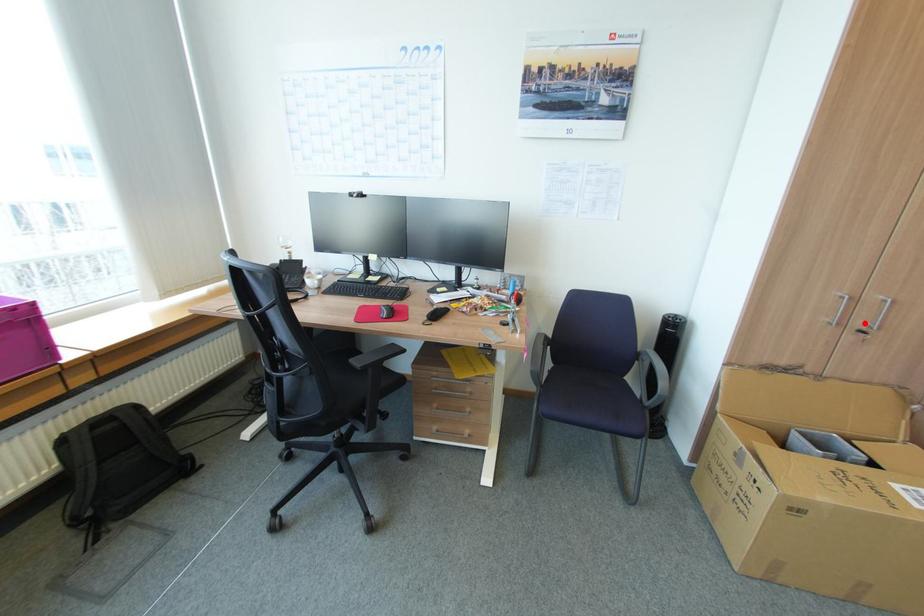
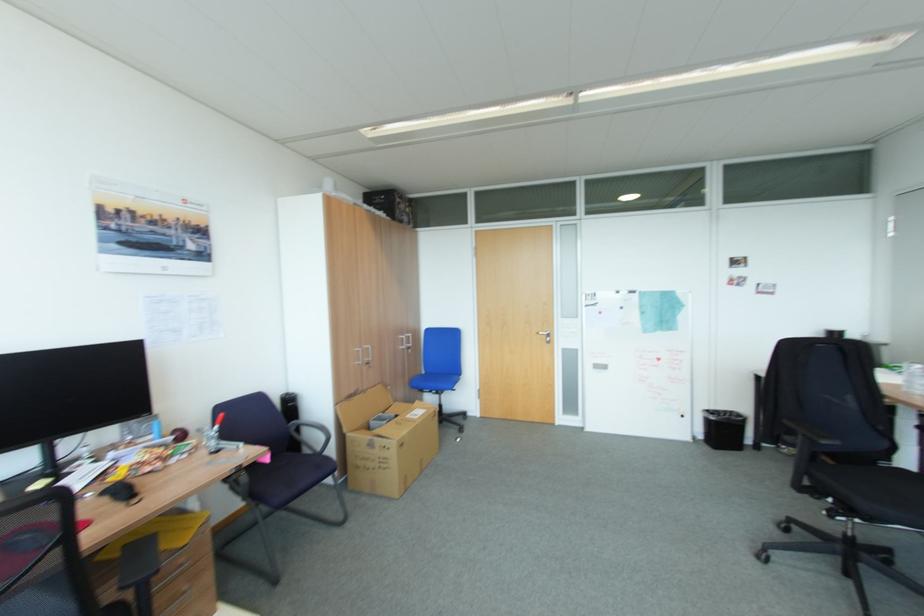
Where in the second image is the point corresponding to the highlighted location from the first image?

(371, 360)